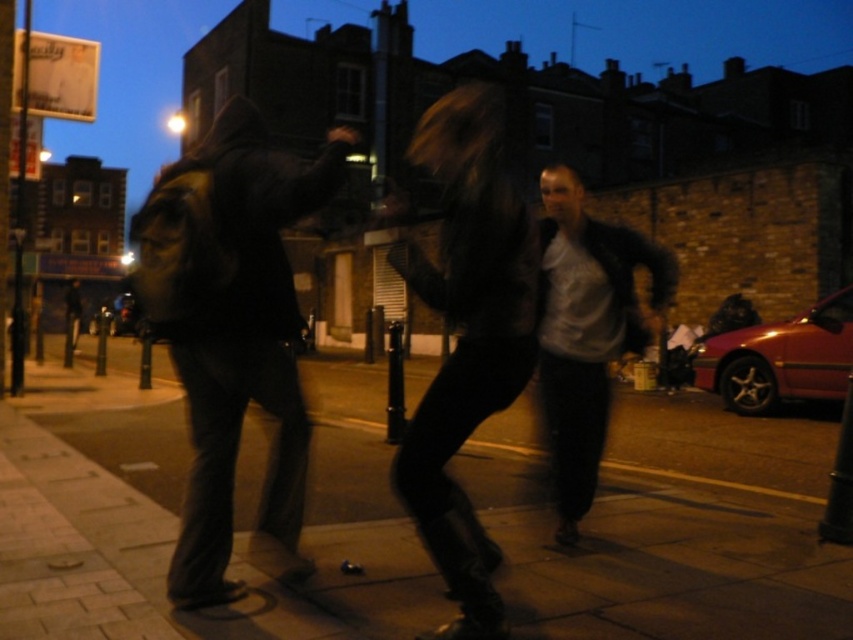
Question: Is white matte jacket at center positioned before brushed metal pole at left?

Choices:
 (A) no
 (B) yes

Answer: (B)

Question: Can you confirm if smooth concrete pavement at center is positioned above white matte jacket at center?

Choices:
 (A) yes
 (B) no

Answer: (B)

Question: Among these points, which one is nearest to the camera?

Choices:
 (A) (450, 456)
 (B) (190, 163)

Answer: (A)

Question: Does dark matte jacket at left have a smaller size compared to white matte jacket at center?

Choices:
 (A) yes
 (B) no

Answer: (B)

Question: Which object appears closest to the camera in this image?

Choices:
 (A) smooth concrete pavement at center
 (B) brushed metal pole at left
 (C) shiny black hair at center
 (D) white matte jacket at center

Answer: (C)

Question: Estimate the real-world distances between objects in this image. Which object is closer to the shiny black hair at center?

Choices:
 (A) white matte jacket at center
 (B) smooth concrete pavement at center
 (C) brushed metal pole at left
 (D) dark matte jacket at left

Answer: (D)